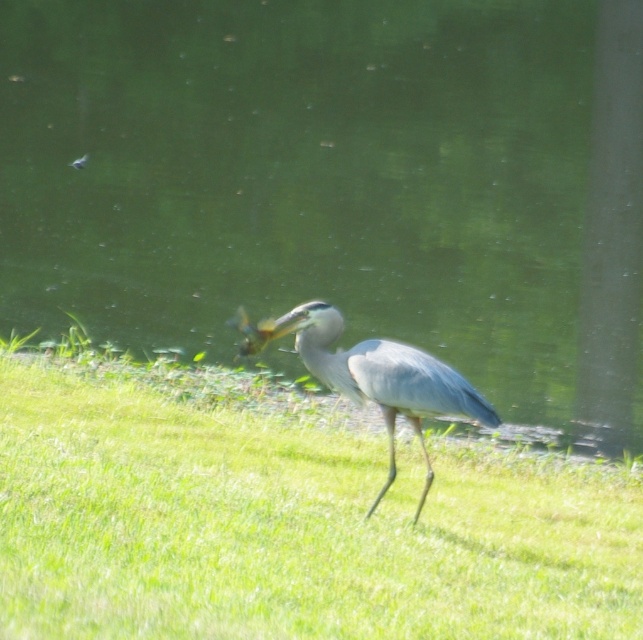
Question: Estimate the real-world distances between objects in this image. Which object is closer to the green water at center?

Choices:
 (A) green grass at center
 (B) gray matte heron at center

Answer: (B)

Question: Can you confirm if green water at center is smaller than gray matte heron at center?

Choices:
 (A) no
 (B) yes

Answer: (A)

Question: Which object is closer to the camera taking this photo?

Choices:
 (A) green water at center
 (B) green grass at center
 (C) gray matte heron at center

Answer: (B)

Question: Which point is closer to the camera?

Choices:
 (A) green water at center
 (B) green grass at center

Answer: (B)

Question: From the image, what is the correct spatial relationship of green water at center in relation to green grass at center?

Choices:
 (A) right
 (B) left

Answer: (B)

Question: Can you confirm if green grass at center is wider than gray matte heron at center?

Choices:
 (A) yes
 (B) no

Answer: (A)